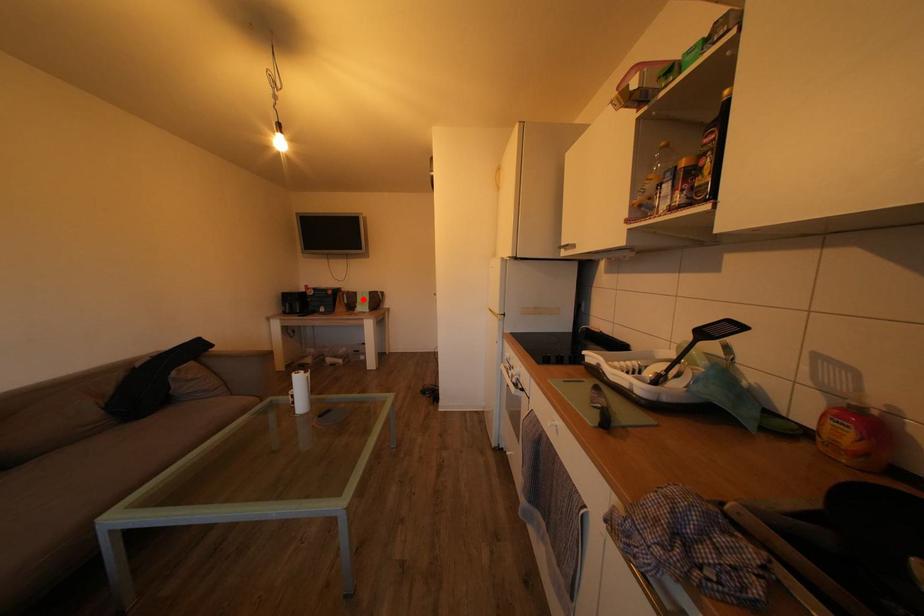
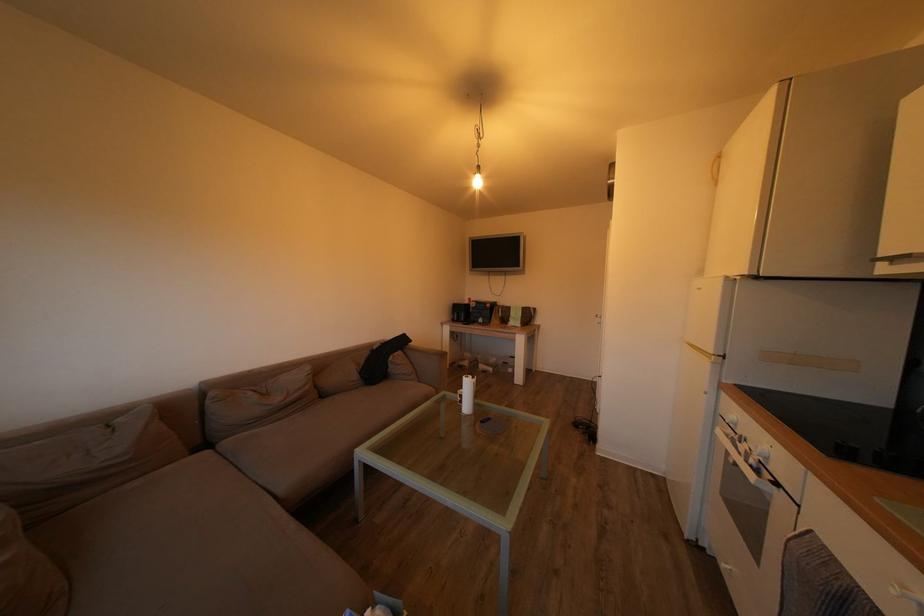
Locate, in the second image, the point that corresponds to the highlighted location in the first image.

(517, 314)